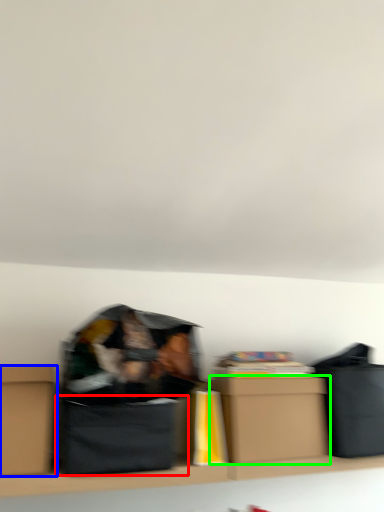
Question: Considering the real-world distances, which object is farthest from cardboard box (highlighted by a red box)? box (highlighted by a blue box) or box (highlighted by a green box)?

Choices:
 (A) box
 (B) box

Answer: (B)